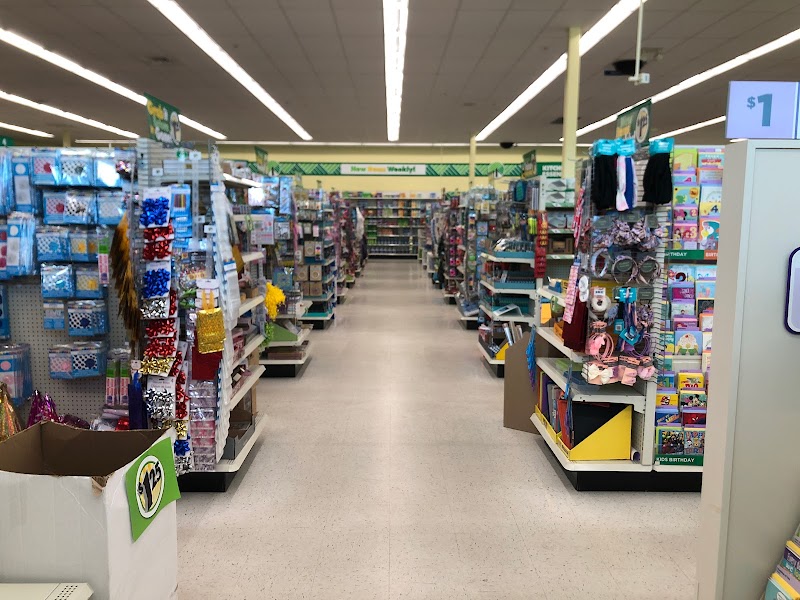
This screenshot has width=800, height=600. Find the location of `white with the appearance of stone tile floor`. white with the appearance of stone tile floor is located at coordinates (416, 479).